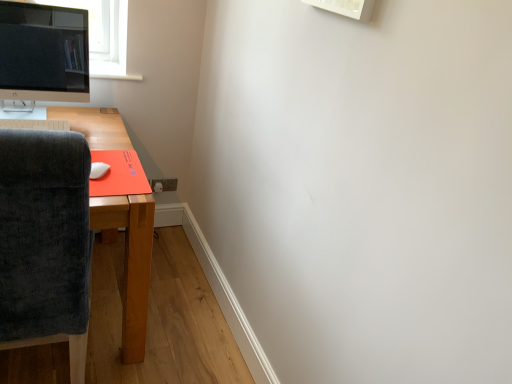
Image resolution: width=512 pixels, height=384 pixels. Find the location of `free point behind dark gray fabric chair at left`. free point behind dark gray fabric chair at left is located at coordinates (147, 304).